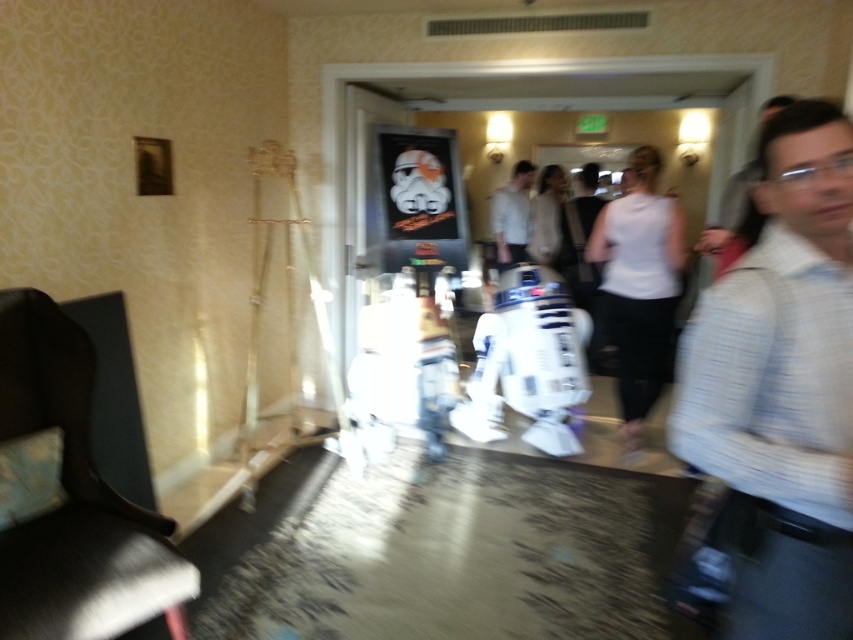
Does white textured shirt at right appear on the right side of white matte shirt at center?

In fact, white textured shirt at right is to the left of white matte shirt at center.

What are the coordinates of `white textured shirt at right` in the screenshot? It's located at (781, 387).